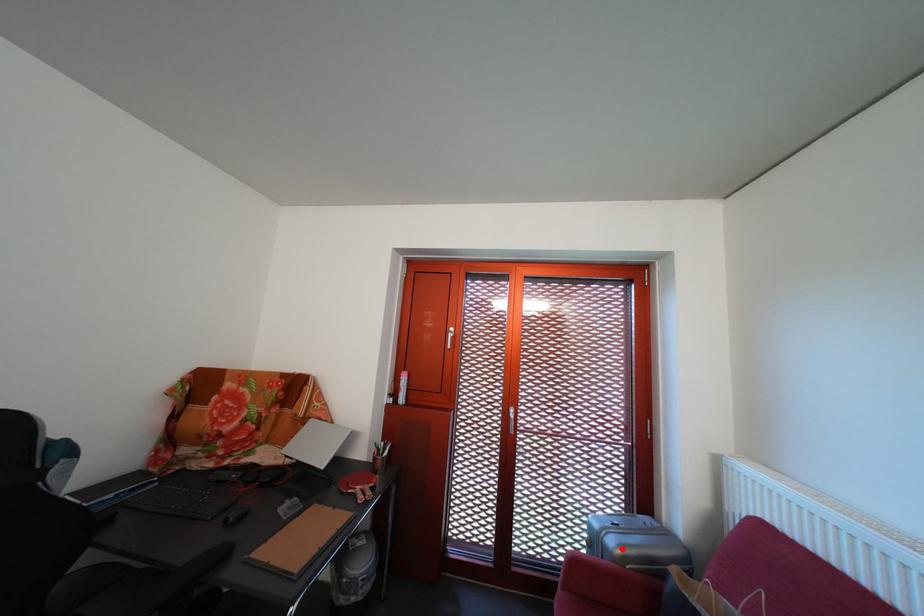
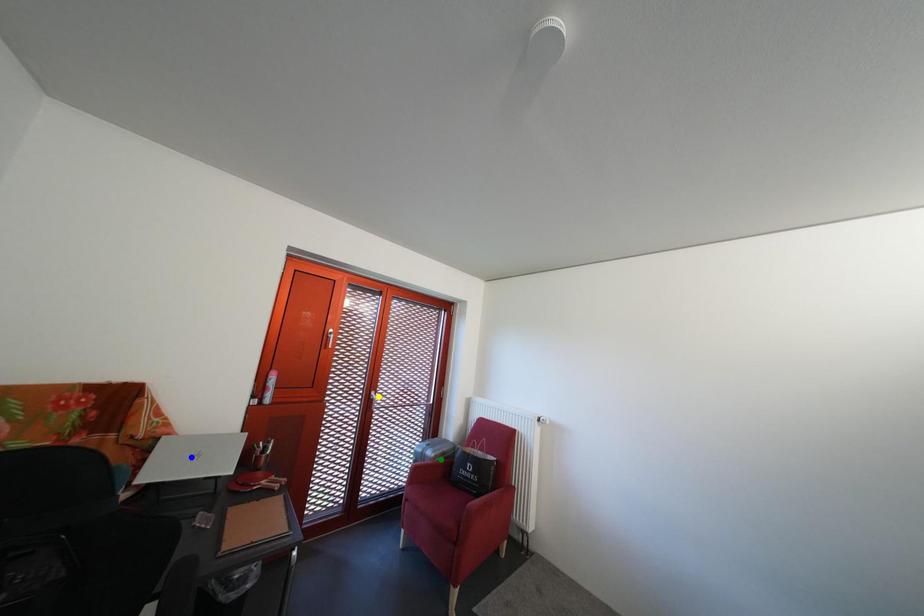
Question: I am providing you with two images of the same scene from different viewpoints. A red point is marked on the first image. You are given multiple points on the second image. Can you choose the point in image 2 that corresponds to the point in image 1?

Choices:
 (A) green point
 (B) yellow point
 (C) blue point

Answer: (A)